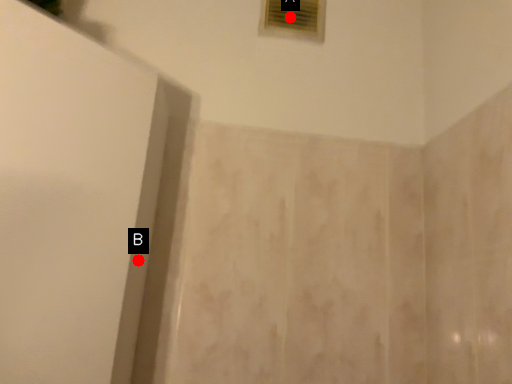
Question: Two points are circled on the image, labeled by A and B beside each circle. Which point is closer to the camera?

Choices:
 (A) A is closer
 (B) B is closer

Answer: (B)